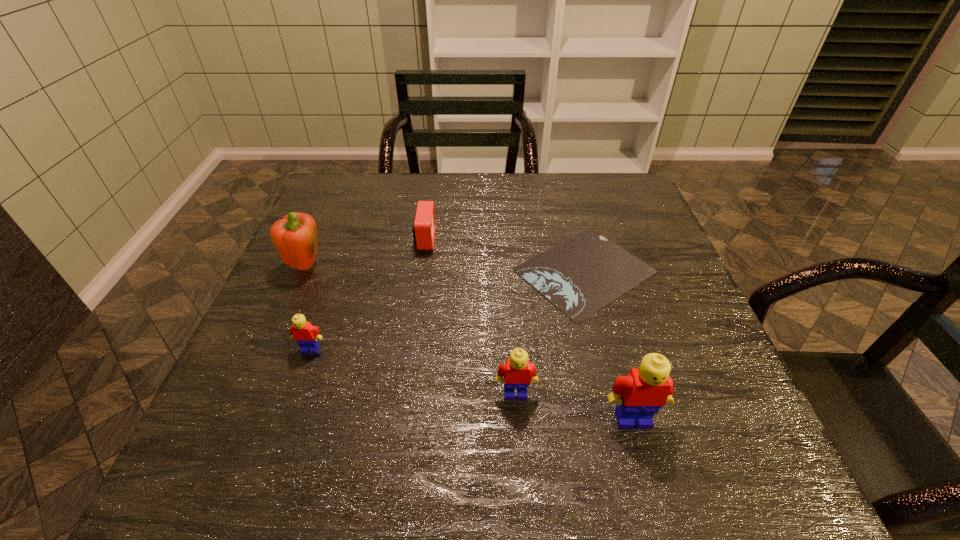
Find the location of a particular element. Image resolution: width=960 pixels, height=540 pixels. the leftmost Lego is located at coordinates (306, 335).

Locate an element on the screen. This screenshot has width=960, height=540. the fourth farthest object is located at coordinates (306, 335).

At what (x,y) coordinates should I click in order to perform the action: click on the second tallest Lego. Please return your answer as a coordinate pair (x, y). The height and width of the screenshot is (540, 960). Looking at the image, I should click on (518, 373).

I want to click on the second Lego from right to left, so click(x=518, y=373).

This screenshot has width=960, height=540. I want to click on the nearest object, so click(x=641, y=394).

Where is `the nearest Lego`? The height and width of the screenshot is (540, 960). the nearest Lego is located at coordinates coord(641,394).

Where is `the shortest object`? the shortest object is located at coordinates (581, 275).

This screenshot has width=960, height=540. In order to click on alarm clock in this screenshot , I will do `click(424, 227)`.

Where is `the leftmost object`? the leftmost object is located at coordinates (295, 236).

Find the location of `vacant space situated on the front-facing side of the shortest Lego`. vacant space situated on the front-facing side of the shortest Lego is located at coordinates (300, 379).